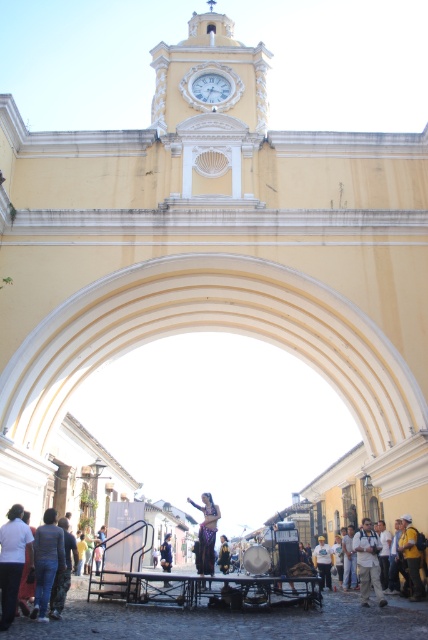
You are a photographer trying to capture the dancer in the vibrant street scene under the archway. You notice the white cotton shirt at center and the blue denim jeans at lower center. Which clothing item appears smaller in the photo?

The white cotton shirt at center appears smaller compared to the blue denim jeans at lower center in the photo.

You are a photographer positioned to the left of the archway. You want to capture both the light brown leather jacket at center and the shiny gold dress at center in your shot. Which object will appear closer to you in the photo?

The light brown leather jacket at center appears closer to you in the photo because it is in front of the shiny gold dress at center.